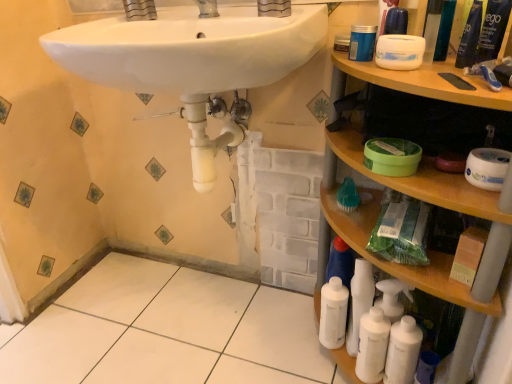
At what (x,y) coordinates should I click in order to perform the action: click on vacant region above white tile floor at lower left (from a real-world perspective). Please return your answer as a coordinate pair (x, y). The height and width of the screenshot is (384, 512). Looking at the image, I should click on (165, 331).